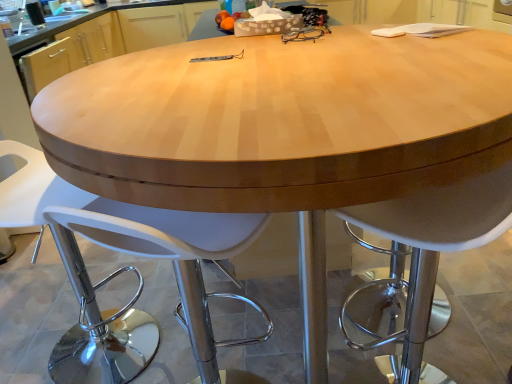
In order to click on white plastic stool at center in this screenshot , I will do `click(122, 268)`.

Image resolution: width=512 pixels, height=384 pixels. Describe the element at coordinates (122, 268) in the screenshot. I see `white plastic stool at center` at that location.

Identify the location of white plastic stool at center. The image size is (512, 384). click(x=122, y=268).